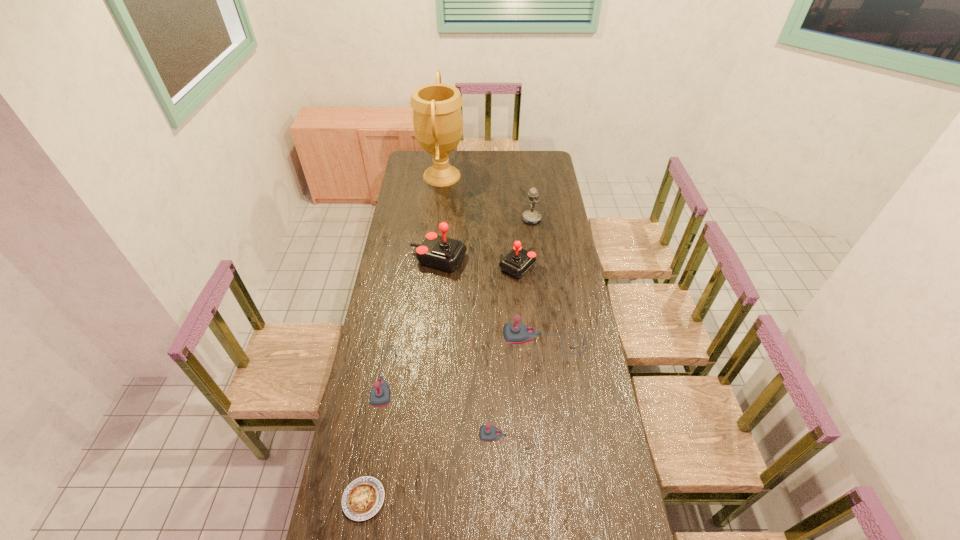
The image size is (960, 540). What are the coordinates of `vacant region between the trophy and the fifth tallest object` in the screenshot? It's located at (493, 258).

I want to click on unoccupied area between the bigger red joystick and the eighth nearest object, so click(485, 239).

Locate an element on the screen. vacant point located between the farthest object and the quiche is located at coordinates click(403, 338).

Locate an element on the screen. This screenshot has width=960, height=540. free point between the smaller red joystick and the tallest joystick is located at coordinates (478, 262).

Select which object is the seventh closest to the nearest gray joystick. Please provide its 2D coordinates. Your answer should be formatted as a tuple, i.e. [(x, y)], where the tuple contains the x and y coordinates of a point satisfying the conditions above.

[(531, 217)]

Select which object is the closest to the second nearest object. Please provide its 2D coordinates. Your answer should be formatted as a tuple, i.e. [(x, y)], where the tuple contains the x and y coordinates of a point satisfying the conditions above.

[(380, 394)]

Identify the location of joystick that is the second closest to the nearest gray joystick. (380, 394).

This screenshot has width=960, height=540. What are the coordinates of `joystick that is the nearest to the tallest object` in the screenshot? It's located at (441, 252).

Where is `gray joystick that is the third closest one to the smaller red joystick`? Image resolution: width=960 pixels, height=540 pixels. gray joystick that is the third closest one to the smaller red joystick is located at coordinates (487, 433).

Identify which gray joystick is located as the second nearest to the calculator. Please provide its 2D coordinates. Your answer should be formatted as a tuple, i.e. [(x, y)], where the tuple contains the x and y coordinates of a point satisfying the conditions above.

[(514, 333)]